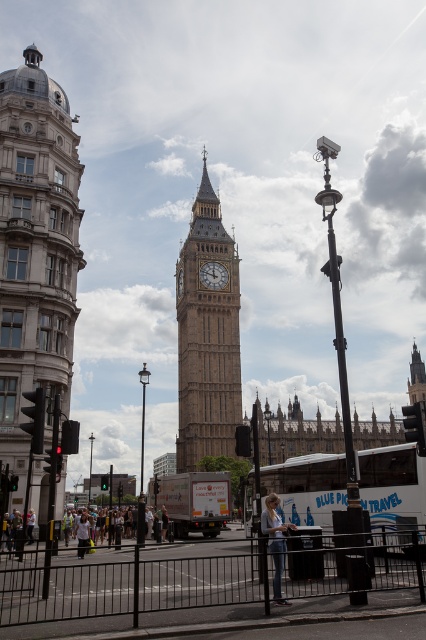
You are a photographer trying to capture the entire white matte bus at center and the silver metallic building at left in a single frame. Based on their sizes, which object will appear smaller in the photo?

The silver metallic building at left will appear smaller in the photo because its width is less than the white matte bus at center.

You are a tourist in London and want to take a photo of the stone clock tower at center. You notice a person wearing denim jeans at lower center blocking your view. Can you estimate whether the person is closer to you than the tower?

The denim jeans at lower center is thinner than the stone clock tower at center, so the person wearing denim jeans at lower center is closer to you than the tower.